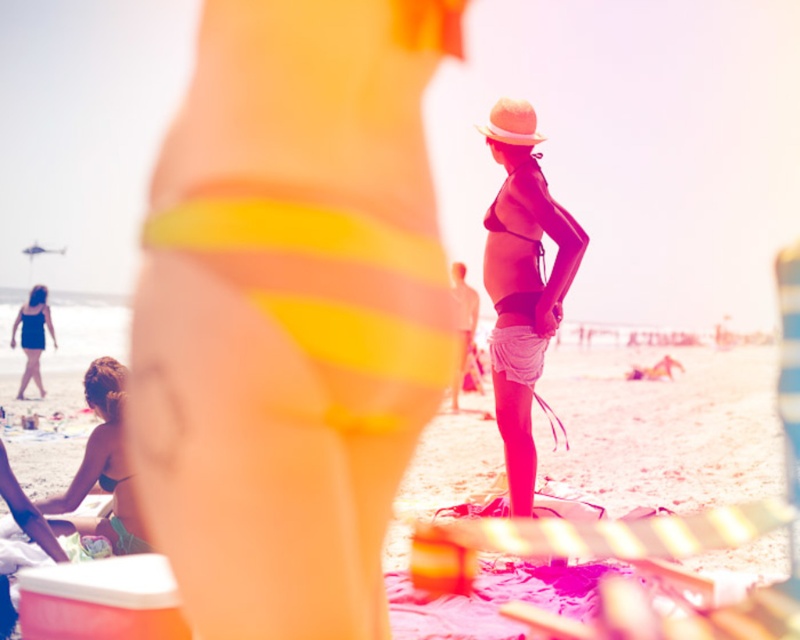
Question: Which object appears closest to the camera in this image?

Choices:
 (A) matte black swimsuit at lower left
 (B) yellow striped bikini bottom at center
 (C) matte yellow bikini bottom at lower left

Answer: (B)

Question: Can you confirm if matte black bikini at center is positioned below matte black swimsuit at lower left?

Choices:
 (A) yes
 (B) no

Answer: (B)

Question: Which object is positioned closest to the matte black bikini at center?

Choices:
 (A) green matte bikini bottom at lower left
 (B) yellow fabric towel at center
 (C) matte yellow bikini bottom at lower left

Answer: (A)

Question: From the image, what is the correct spatial relationship of yellow striped bikini bottom at center in relation to matte black swimsuit at lower left?

Choices:
 (A) left
 (B) right

Answer: (B)

Question: Which point is farther to the camera?

Choices:
 (A) (632, 396)
 (B) (134, 541)
 (C) (28, 316)

Answer: (A)

Question: Is green matte bikini bottom at lower left above matte yellow bikini bottom at lower left?

Choices:
 (A) no
 (B) yes

Answer: (B)